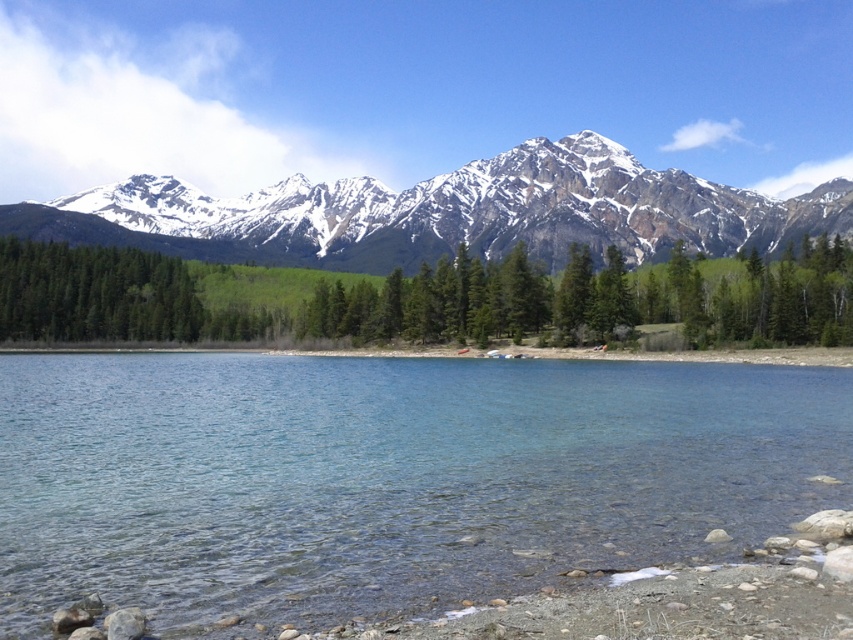
You are a hiker planning to traverse from the green matte trees at center to the snowy granite mountain range at upper center. Given that your average walking pace is 4 km per hour, how long would it take you to reach the mountain range from the trees?

The snowy granite mountain range at upper center is 140.60 meters from the green matte trees at center. At a walking pace of 4 km per hour, it would take approximately 21 seconds to cover the distance.

You are an environmental scientist assessing the landscape. You observe the clear glass water at center and the green matte trees at center. Which object appears taller in the scene?

The green matte trees at center appear taller than the clear glass water at center.